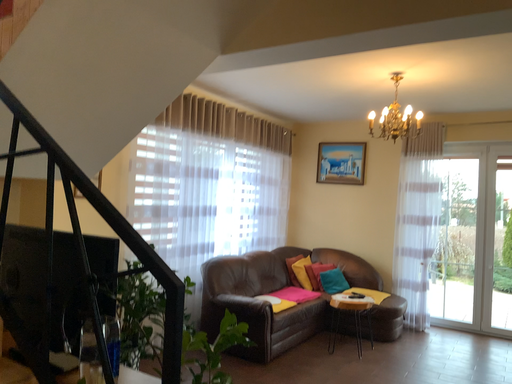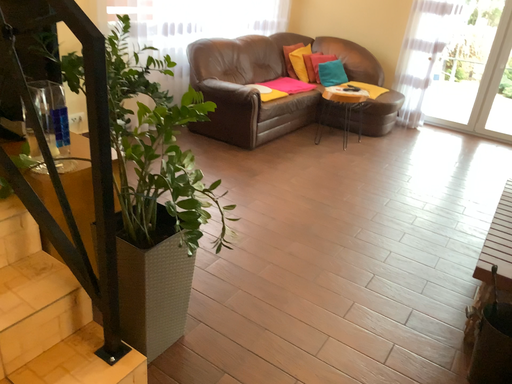
Question: Which way did the camera rotate in the video?

Choices:
 (A) rotated upward
 (B) rotated downward

Answer: (B)